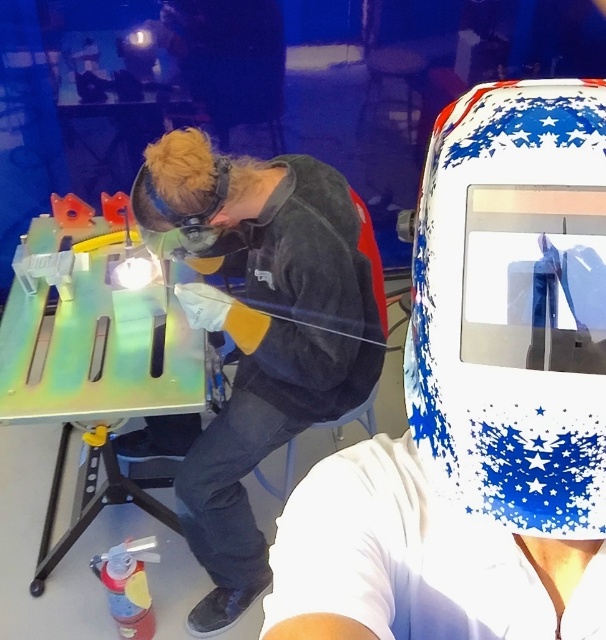
Question: Which object is the farthest from the matte black goggles at center?

Choices:
 (A) matte black welding helmet at center
 (B) metallic/reflective welding table at left
 (C) white matte welding helmet at upper right

Answer: (C)

Question: Is white matte welding helmet at upper right wider than matte black goggles at center?

Choices:
 (A) no
 (B) yes

Answer: (B)

Question: Among these objects, which one is nearest to the camera?

Choices:
 (A) metallic/reflective welding table at left
 (B) white matte welding helmet at upper right

Answer: (B)

Question: Does white matte welding helmet at upper right appear under matte black welding helmet at center?

Choices:
 (A) no
 (B) yes

Answer: (A)

Question: Which point is farther to the camera?

Choices:
 (A) (213, 554)
 (B) (524, 292)
 (C) (190, 228)
 (D) (55, 353)

Answer: (A)

Question: In this image, where is metallic/reflective welding table at left located relative to matte black goggles at center?

Choices:
 (A) above
 (B) below

Answer: (B)